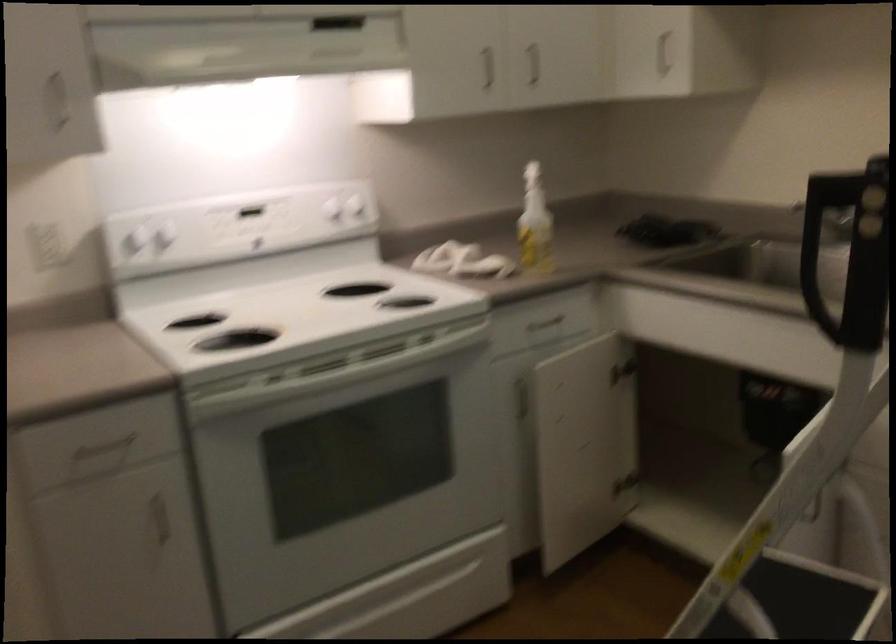
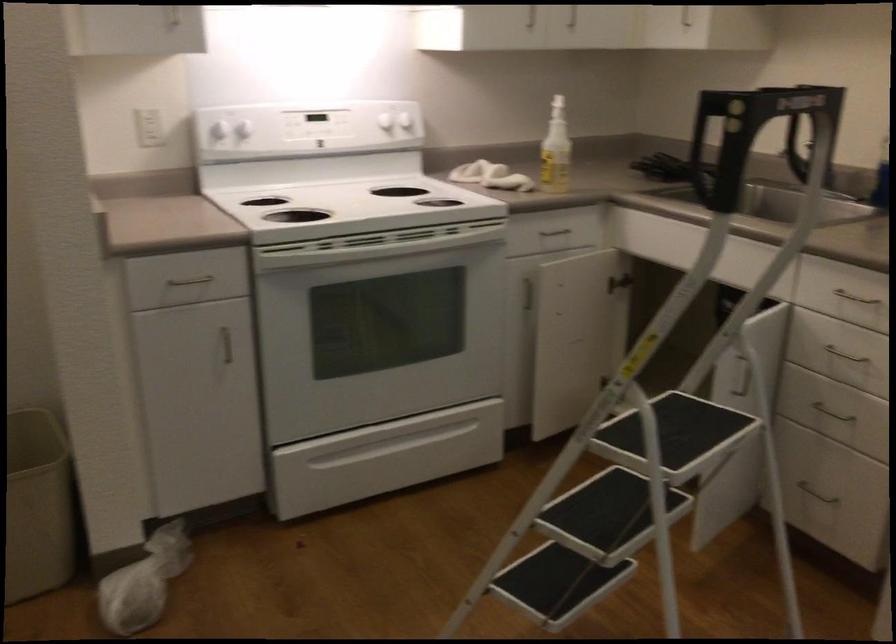
Where in the second image is the point corresponding to (x=528, y=161) from the first image?

(557, 97)